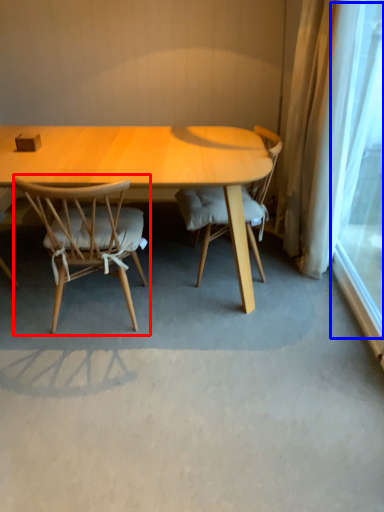
Question: Which object is further to the camera taking this photo, chair (highlighted by a red box) or window screen (highlighted by a blue box)?

Choices:
 (A) chair
 (B) window screen

Answer: (A)